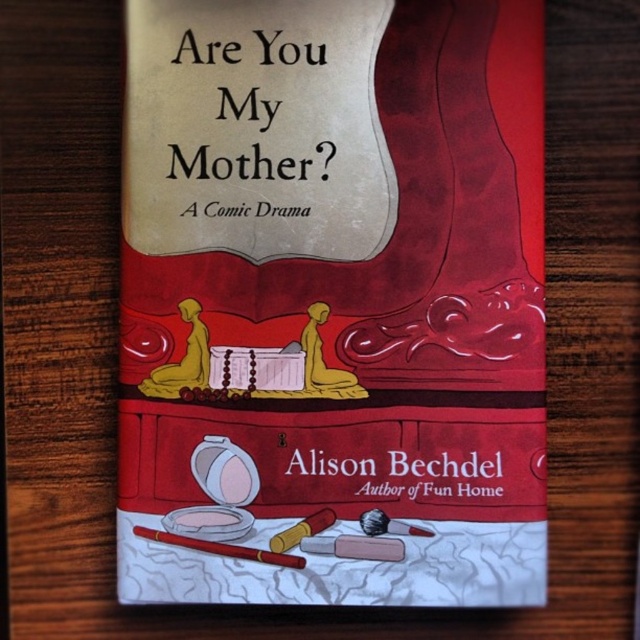
Where is the matte paper book at center located in terms of coordinates?

The matte paper book at center is located at point coordinates of (x=333, y=301).

You are an artist who wants to draw the scene on the book cover. You have a smooth brown pencil at bottom center and a matte paper book at center. Which object should you pick up first to start drawing the book cover?

The smooth brown pencil at bottom center is behind the matte paper book at center, so you should pick up the matte paper book at center first to access the pencil.